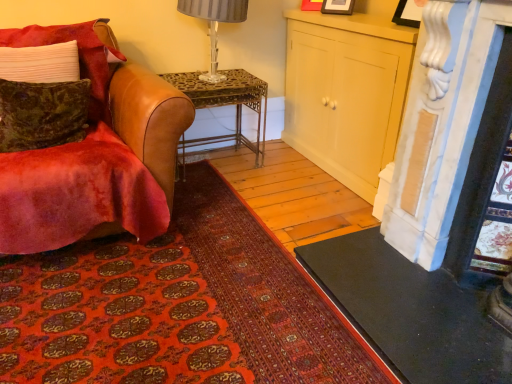
Question: Is matte cream cabinet at center situated inside velvet green pillow at left, which ranks as the 1th pillow in bottom-to-top order, or outside?

Choices:
 (A) inside
 (B) outside

Answer: (B)

Question: Considering the relative positions of matte cream cabinet at center and velvet green pillow at left, which ranks as the 2th pillow in top-to-bottom order, in the image provided, is matte cream cabinet at center to the left or to the right of velvet green pillow at left, which ranks as the 2th pillow in top-to-bottom order,?

Choices:
 (A) right
 (B) left

Answer: (A)

Question: Which object is positioned farthest from the metallic silver lamp at upper center?

Choices:
 (A) velvet green pillow at left, which ranks as the 1th pillow in bottom-to-top order
 (B) velvet brown leather chair at left
 (C) velvet green pillow at left, arranged as the first pillow when viewed from the top
 (D) matte cream cabinet at center
 (E) metallic wrought iron desk at center

Answer: (A)

Question: Considering the real-world distances, which object is closest to the metallic wrought iron desk at center?

Choices:
 (A) velvet brown leather chair at left
 (B) velvet green pillow at left, which is the second pillow from bottom to top
 (C) white marble fireplace at right
 (D) velvet green pillow at left, which ranks as the 2th pillow in top-to-bottom order
 (E) matte cream cabinet at center

Answer: (E)